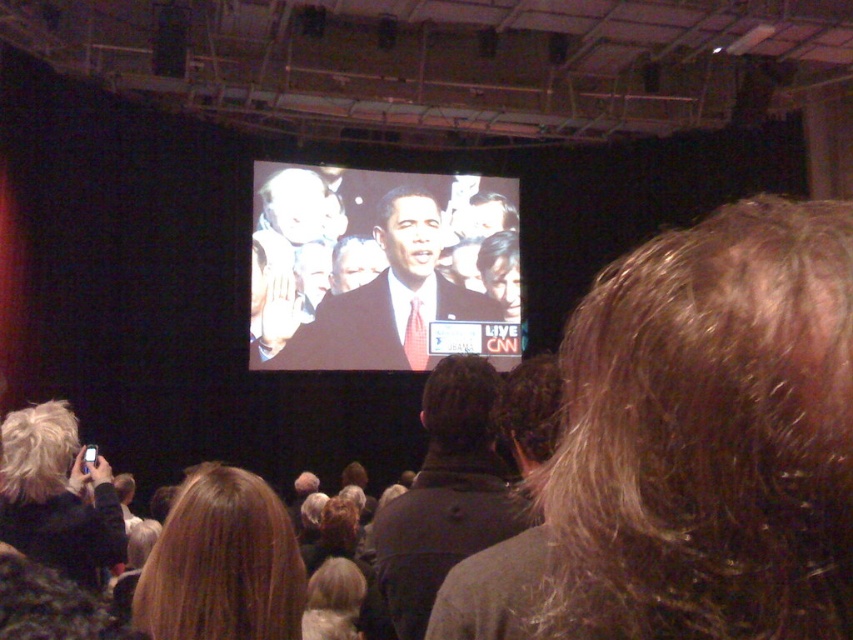
Does matte black suit at center appear on the right side of dark gray jacket at center?

Incorrect, matte black suit at center is not on the right side of dark gray jacket at center.

From the picture: Does matte black suit at center appear over dark gray jacket at center?

Correct, matte black suit at center is located above dark gray jacket at center.

The image size is (853, 640). Describe the element at coordinates (383, 269) in the screenshot. I see `matte black suit at center` at that location.

I want to click on matte black suit at center, so click(383, 269).

Is point (332, 326) farther from viewer compared to point (241, 529)?

Yes, it is behind point (241, 529).

Between matte black suit at center and blonde hair at lower center, which one is positioned higher?

Positioned higher is matte black suit at center.

Measure the distance between point [445,262] and camera.

Point [445,262] is 10.03 meters from camera.

Image resolution: width=853 pixels, height=640 pixels. I want to click on matte black suit at center, so click(x=383, y=269).

Between blonde hair at lower center and dark gray jacket at center, which one appears on the right side from the viewer's perspective?

From the viewer's perspective, dark gray jacket at center appears more on the right side.

Which is above, blonde hair at lower center or dark gray jacket at center?

blonde hair at lower center is above.

Identify the location of blonde hair at lower center. point(222,563).

What are the coordinates of `blonde hair at lower center` in the screenshot? It's located at (222, 563).